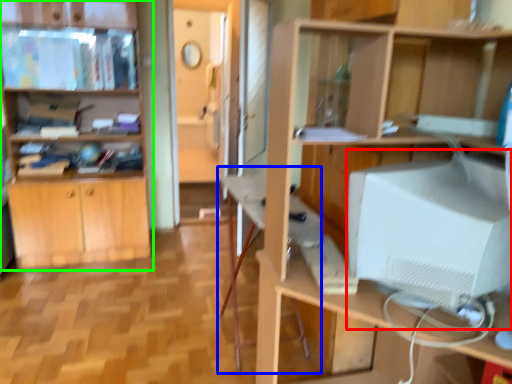
Question: Which object is positioned farthest from computer monitor (highlighted by a red box)? Select from computer desk (highlighted by a blue box) and cabinetry (highlighted by a green box).

Choices:
 (A) computer desk
 (B) cabinetry

Answer: (B)